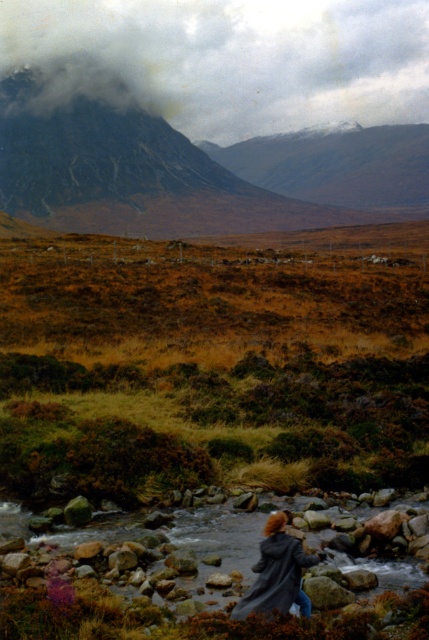
Question: Is cloudy gray mountain at upper center smaller than rugged stone mountain at upper left?

Choices:
 (A) yes
 (B) no

Answer: (B)

Question: Which of the following is the farthest from the observer?

Choices:
 (A) dark gray coat at center
 (B) rugged stone mountain at upper left
 (C) cloudy gray mountain at upper center

Answer: (C)

Question: Which of the following is the farthest from the observer?

Choices:
 (A) rugged stone mountain at upper left
 (B) cloudy gray mountain at upper center
 (C) smooth rock river at lower center

Answer: (B)

Question: Considering the relative positions of cloudy gray mountain at upper center and dark gray coat at center in the image provided, where is cloudy gray mountain at upper center located with respect to dark gray coat at center?

Choices:
 (A) left
 (B) right

Answer: (A)

Question: Which object appears closest to the camera in this image?

Choices:
 (A) cloudy gray mountain at upper center
 (B) smooth rock river at lower center
 (C) dark gray coat at center

Answer: (C)

Question: Does cloudy gray mountain at upper center appear on the right side of dark gray coat at center?

Choices:
 (A) yes
 (B) no

Answer: (B)